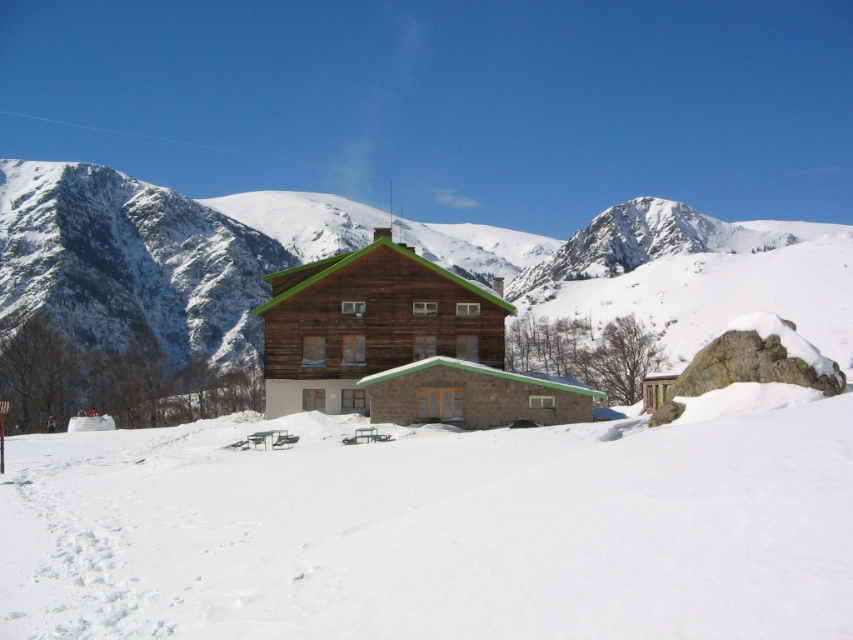
You are standing in front of the rustic wooden building and notice two features at the center of the image. Which one is positioned to the left between the white snow at center and the snowy rock at center?

The white snow at center is positioned to the left of the snowy rock at center.

You are planning to build a small cabin in the area shown. You have two options for the foundation location. One is on the white snow at center and the other is on the snowy rock at center. Based on the scene description, which location has more space for the foundation?

The snowy rock at center has more space for the foundation because the white snow at center occupies less space than the snowy rock at center.

You are standing in front of the wooden cabin at center and want to walk towards the white snow at center. In which direction should you move relative to the cabin?

The white snow at center is to the left of the wooden cabin at center, so you should move to the left relative to the cabin to reach the white snow at center.